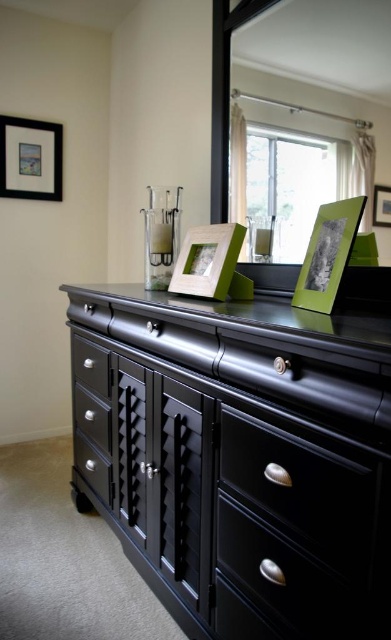
Question: Is the position of green matte picture frame at right less distant than that of green matte picture frame at upper center?

Choices:
 (A) no
 (B) yes

Answer: (B)

Question: Does matte white picture frame at center come behind green matte picture frame at upper center?

Choices:
 (A) yes
 (B) no

Answer: (A)

Question: Which point is farther from the camera taking this photo?

Choices:
 (A) (389, 211)
 (B) (355, 200)
 (C) (163, 442)

Answer: (C)

Question: Is matte black drawer at lower left positioned behind green matte picture frame at upper center?

Choices:
 (A) no
 (B) yes

Answer: (B)

Question: Among these objects, which one is farthest from the camera?

Choices:
 (A) matte black drawer at lower left
 (B) green matte picture frame at right

Answer: (A)

Question: Among these points, which one is nearest to the camera?

Choices:
 (A) (46, 173)
 (B) (215, 189)
 (C) (324, 244)
 (D) (152, 426)

Answer: (C)